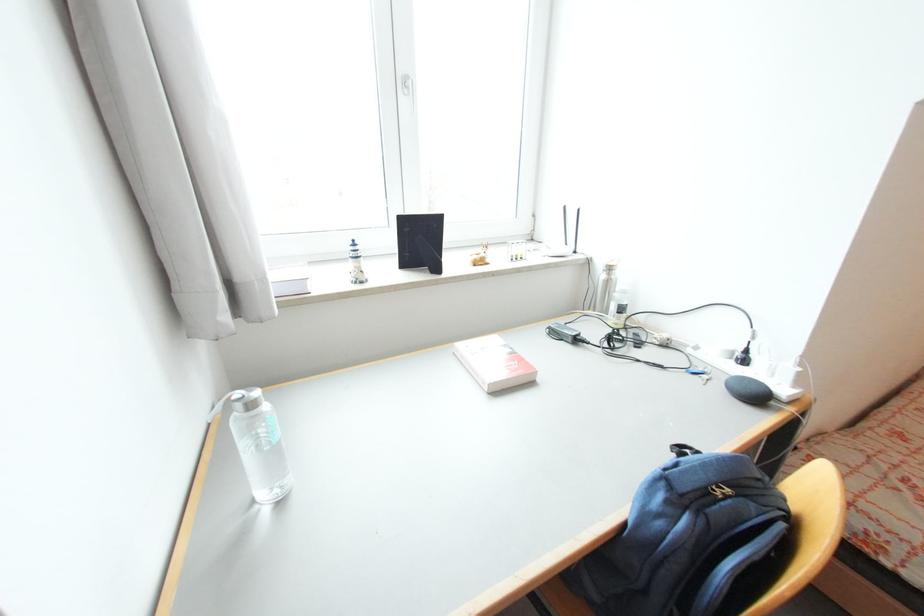
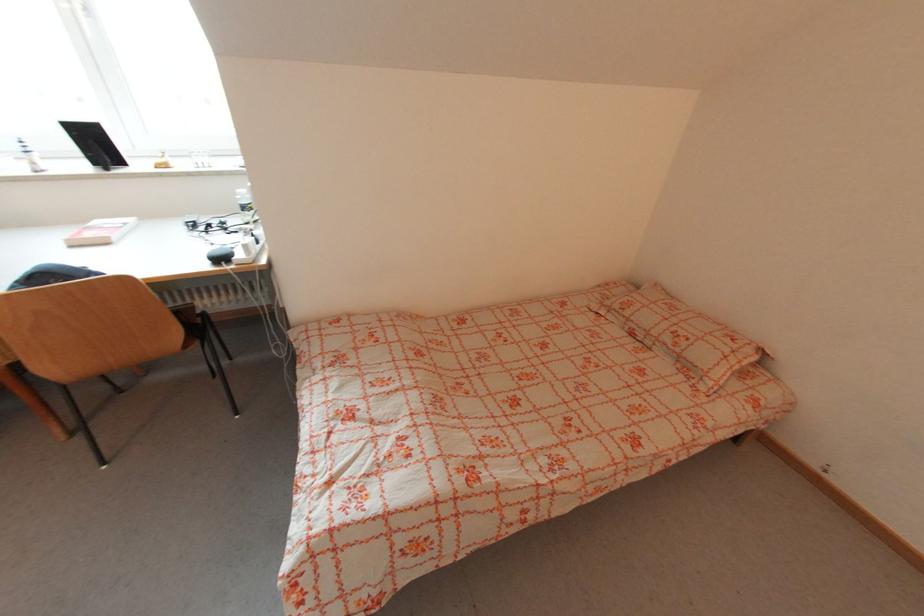
Question: Which direction would the cameraman need to move to produce the second image? Reply with the corresponding letter.

Choices:
 (A) Left
 (B) Right
 (C) Forward
 (D) Backward

Answer: (B)